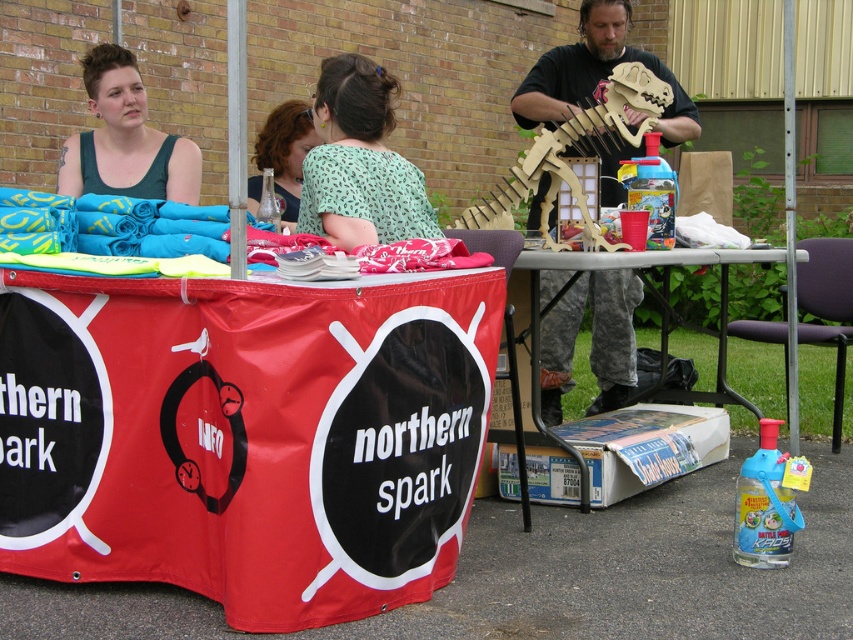
Question: Based on their relative distances, which object is farther from the green printed shirt at center?

Choices:
 (A) matte black tank top at upper left
 (B) metallic silver table at center
 (C) wooden dinosaur skeleton at right
 (D) matte glass bottle at center

Answer: (C)

Question: Estimate the real-world distances between objects in this image. Which object is farther from the metallic silver table at center?

Choices:
 (A) wooden dinosaur skeleton at right
 (B) matte black tank top at upper left
 (C) matte glass bottle at center

Answer: (B)

Question: From the image, what is the correct spatial relationship of green printed shirt at center in relation to metallic silver table at center?

Choices:
 (A) below
 (B) above

Answer: (B)

Question: Where is metallic silver table at center located in relation to matte glass bottle at center in the image?

Choices:
 (A) above
 (B) below

Answer: (B)

Question: Is wooden dinosaur skeleton at right above matte black tank top at upper left?

Choices:
 (A) yes
 (B) no

Answer: (A)

Question: Which is nearer to the wooden dinosaur skeleton at right?

Choices:
 (A) matte black tank top at upper left
 (B) matte glass bottle at center

Answer: (B)